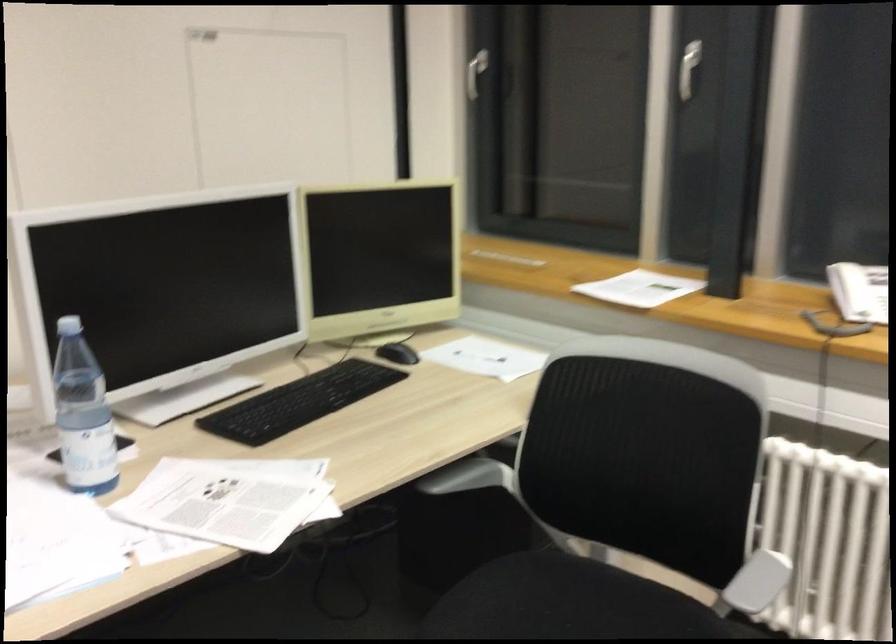
Identify the location of white chair armrest. This screenshot has width=896, height=644. (757, 582).